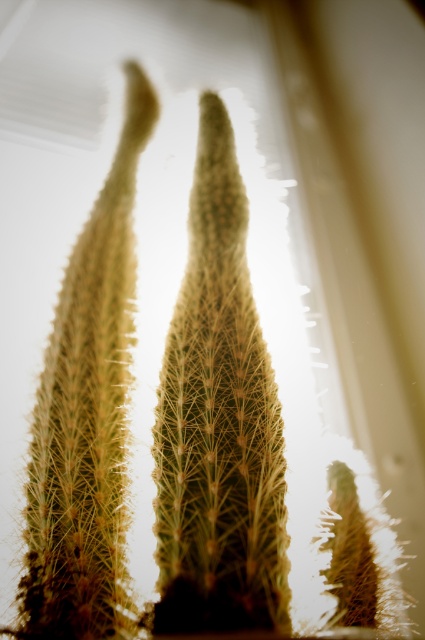
Question: Does green spiky cactus at center appear under green spiky cactus at left?

Choices:
 (A) yes
 (B) no

Answer: (A)

Question: Is green spiky cactus at center bigger than green spiky cactus at left?

Choices:
 (A) yes
 (B) no

Answer: (B)

Question: Which object is closer to the camera taking this photo?

Choices:
 (A) green spiky cactus at center
 (B) green spiky cactus at left

Answer: (A)

Question: Is green spiky cactus at center positioned at the back of green spiky cactus at left?

Choices:
 (A) no
 (B) yes

Answer: (A)